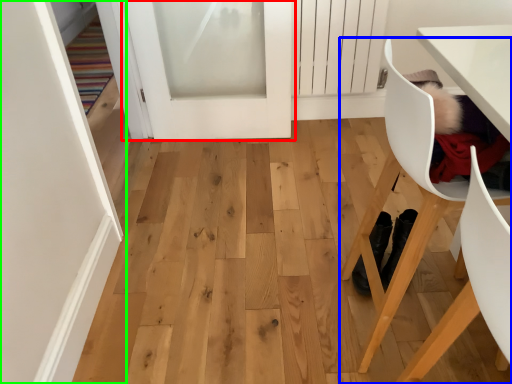
Question: Which object is positioned closest to door (highlighted by a red box)? Select from chair (highlighted by a blue box) and door (highlighted by a green box).

Choices:
 (A) chair
 (B) door

Answer: (B)